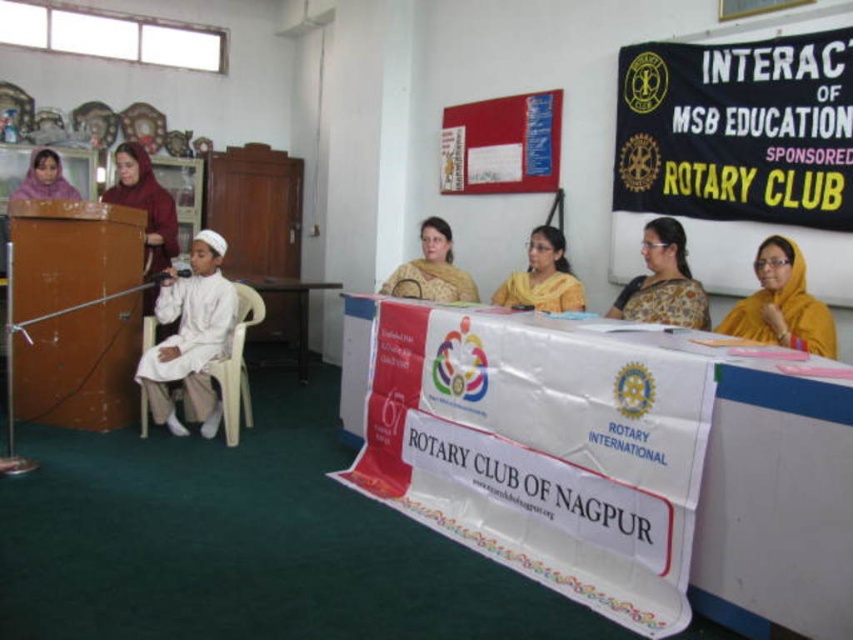
Question: Among these points, which one is nearest to the camera?

Choices:
 (A) (166, 417)
 (B) (809, 305)

Answer: (B)

Question: Which of the following is the closest to the observer?

Choices:
 (A) (674, 250)
 (B) (776, 262)
 (C) (119, 152)
 (D) (524, 282)

Answer: (B)

Question: Estimate the real-world distances between objects in this image. Which object is farther from the white cotton robe at center?

Choices:
 (A) yellow silk saree at center
 (B) yellow fabric at center

Answer: (B)

Question: Can you confirm if white cotton robe at center is thinner than satin yellow sari at center?

Choices:
 (A) yes
 (B) no

Answer: (B)

Question: Can you confirm if white cotton robe at center is thinner than satin yellow sari at center?

Choices:
 (A) no
 (B) yes

Answer: (A)

Question: Can you confirm if yellow fabric at center is bigger than matte maroon dress at left?

Choices:
 (A) yes
 (B) no

Answer: (B)